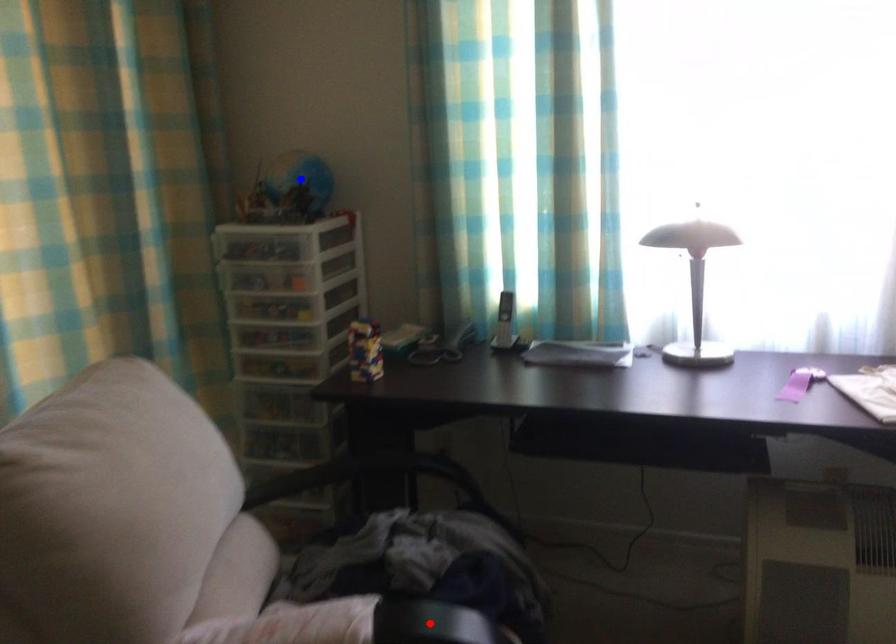
Question: Which of the two points in the image is closer to the camera?

Choices:
 (A) Blue point is closer.
 (B) Red point is closer.

Answer: (B)